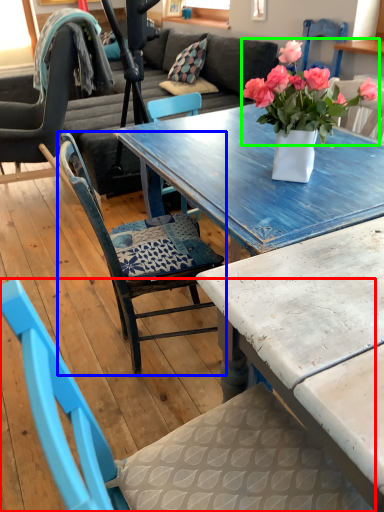
Question: Which object is positioned closest to chair (highlighted by a red box)? Select from chair (highlighted by a blue box) and flower (highlighted by a green box).

Choices:
 (A) chair
 (B) flower

Answer: (A)